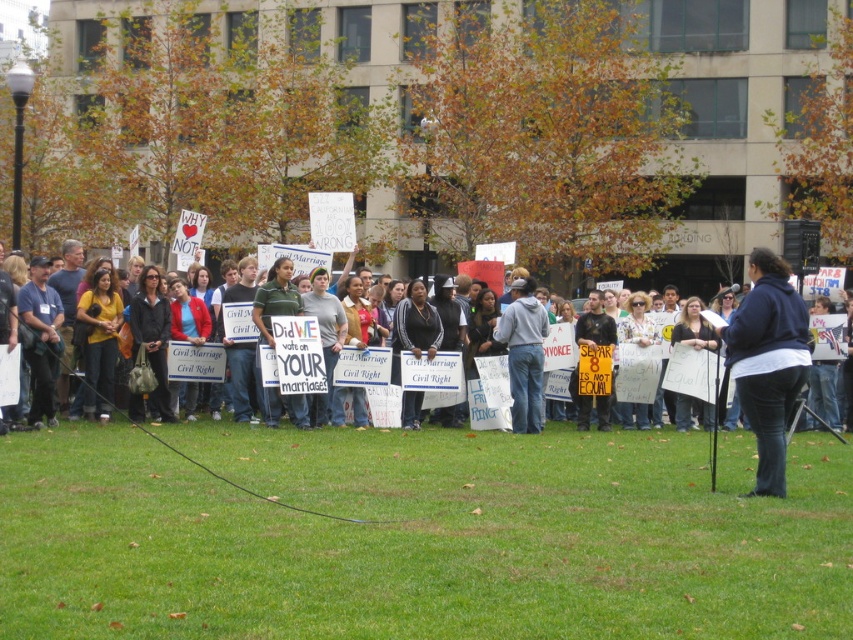
Does green grass at lower center lie behind dark blue jeans at center?

That is False.

Can you confirm if green grass at lower center is positioned to the left of dark blue jeans at center?

Indeed, green grass at lower center is positioned on the left side of dark blue jeans at center.

Image resolution: width=853 pixels, height=640 pixels. Find the location of `green grass at lower center`. green grass at lower center is located at coordinates (418, 536).

Between dark blue hoodie at center and denim jeans at center, which one appears on the right side from the viewer's perspective?

dark blue hoodie at center is more to the right.

Can you confirm if dark blue hoodie at center is positioned above denim jeans at center?

Yes, dark blue hoodie at center is above denim jeans at center.

What do you see at coordinates (769, 362) in the screenshot? This screenshot has width=853, height=640. I see `dark blue hoodie at center` at bounding box center [769, 362].

Where is `dark blue hoodie at center`? dark blue hoodie at center is located at coordinates (769, 362).

Can you confirm if dark blue hoodie at center is positioned below dark blue jeans at center?

No.

Does dark blue hoodie at center have a lesser width compared to dark blue jeans at center?

Yes.

Is point (733, 364) in front of point (265, 252)?

Yes, point (733, 364) is in front of point (265, 252).

The image size is (853, 640). Identify the location of dark blue hoodie at center. (769, 362).